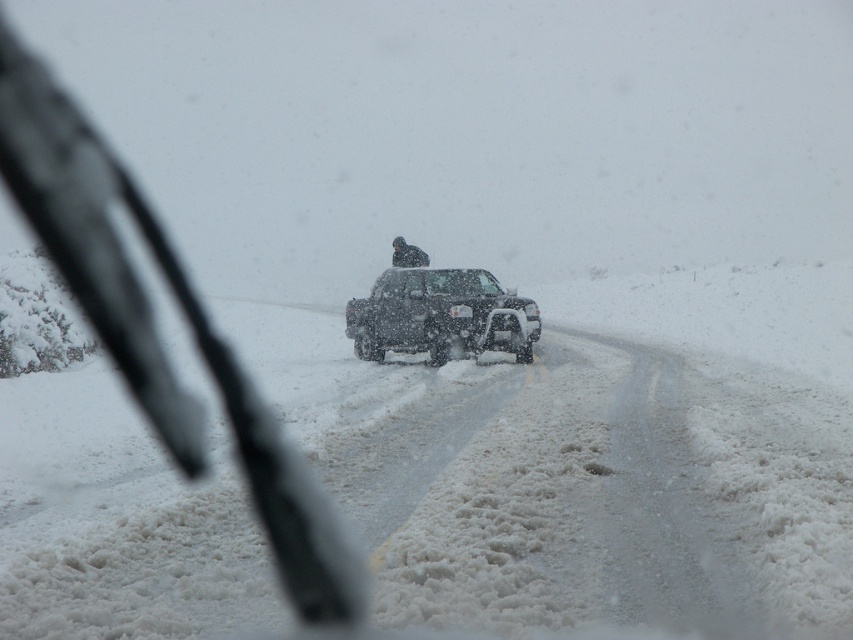
Can you confirm if snow-covered black truck at center is wider than dark gray fabric jacket at center?

Yes, snow-covered black truck at center is wider than dark gray fabric jacket at center.

From the picture: Does snow-covered black truck at center appear on the left side of dark gray fabric jacket at center?

Incorrect, snow-covered black truck at center is not on the left side of dark gray fabric jacket at center.

Is point (521, 317) positioned behind point (418, 259)?

That is False.

Find the location of a particular element. The width and height of the screenshot is (853, 640). snow-covered black truck at center is located at coordinates (440, 316).

Between point (260, 419) and point (364, 339), which one is positioned behind?

Point (364, 339)

This screenshot has height=640, width=853. Find the location of `transparent glass windshield at center`. transparent glass windshield at center is located at coordinates (155, 330).

Image resolution: width=853 pixels, height=640 pixels. I want to click on transparent glass windshield at center, so click(x=155, y=330).

Does transparent glass windshield at center lie behind dark gray fabric jacket at center?

No, transparent glass windshield at center is in front of dark gray fabric jacket at center.

Which is in front, point (0, 64) or point (410, 253)?

Point (410, 253) is more forward.

Identify the location of transparent glass windshield at center. This screenshot has width=853, height=640. (155, 330).